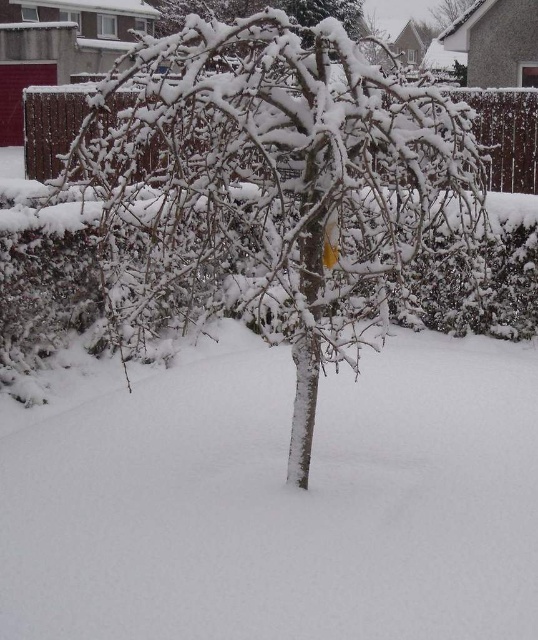
Which is in front, point (260, 99) or point (441, 29)?

Positioned in front is point (260, 99).

Does snow-covered branches at center come in front of snow-covered tree at upper center?

That is True.

Where is `snow-covered branches at center`? snow-covered branches at center is located at coordinates (269, 189).